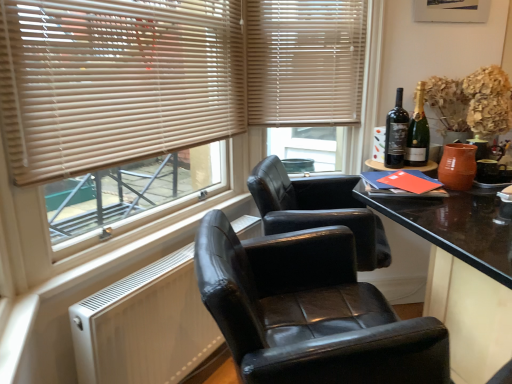
Question: Is point (385, 148) positioned closer to the camera than point (31, 61)?

Choices:
 (A) farther
 (B) closer

Answer: (A)

Question: From a real-world perspective, relative to beige wood blinds at upper left, is black glass bottle at upper right, placed as the 2th bottle when sorted from right to left, vertically above or below?

Choices:
 (A) above
 (B) below

Answer: (B)

Question: Which object is the closest to the beige wood blinds at upper center?

Choices:
 (A) beige wood blinds at upper left
 (B) black glass bottle at upper right, placed as the 2th bottle when sorted from right to left
 (C) black leather chair at center
 (D) matte glass bottle at upper right, placed as the 2th bottle when sorted from left to right

Answer: (A)

Question: Considering the real-world distances, which object is farthest from the matte glass bottle at upper right, which appears as the first bottle when viewed from the right?

Choices:
 (A) beige wood blinds at upper left
 (B) black leather chair at center
 (C) black glass bottle at upper right, acting as the first bottle starting from the left
 (D) beige wood blinds at upper center

Answer: (B)